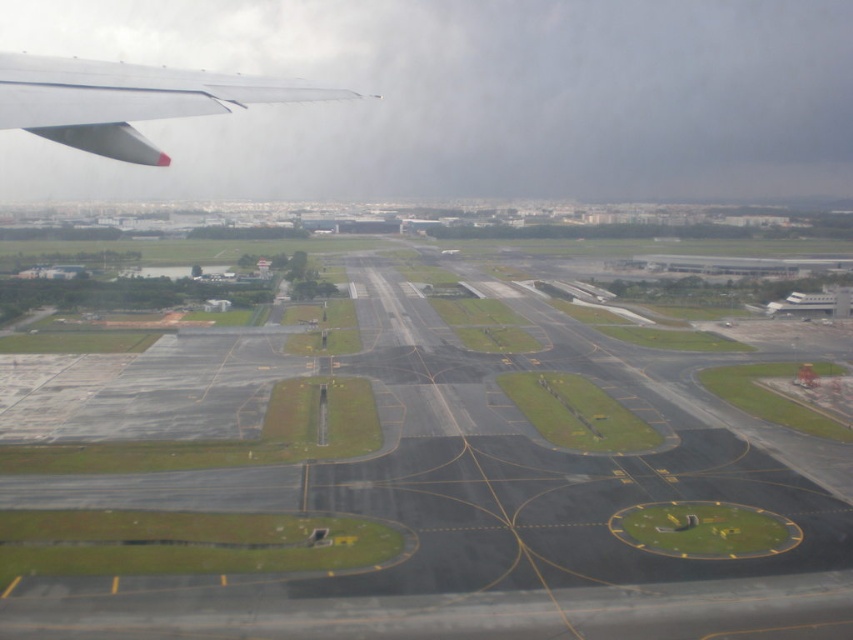
Question: Among these points, which one is nearest to the camera?

Choices:
 (A) (113, 96)
 (B) (45, 500)

Answer: (A)

Question: Does black asphalt tarmac at center appear over matte white wing at upper left?

Choices:
 (A) yes
 (B) no

Answer: (B)

Question: Among these points, which one is nearest to the camera?

Choices:
 (A) (509, 404)
 (B) (125, 138)

Answer: (B)

Question: Can you confirm if black asphalt tarmac at center is bigger than matte white wing at upper left?

Choices:
 (A) yes
 (B) no

Answer: (B)

Question: Can you confirm if black asphalt tarmac at center is positioned below matte white wing at upper left?

Choices:
 (A) no
 (B) yes

Answer: (B)